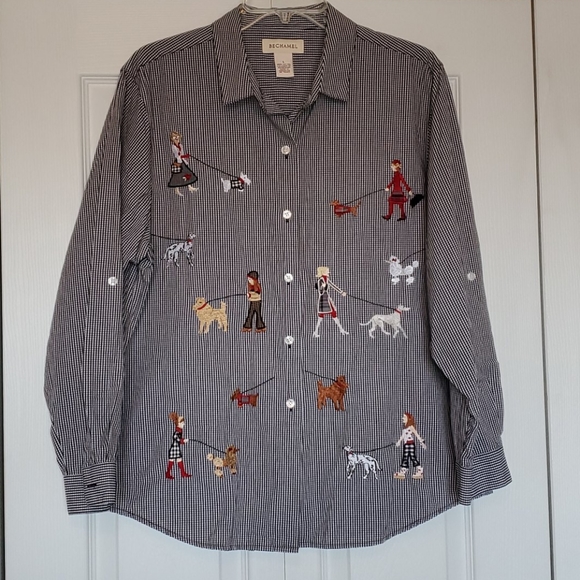
Where is `artwork middle left`? artwork middle left is located at coordinates (166, 242).